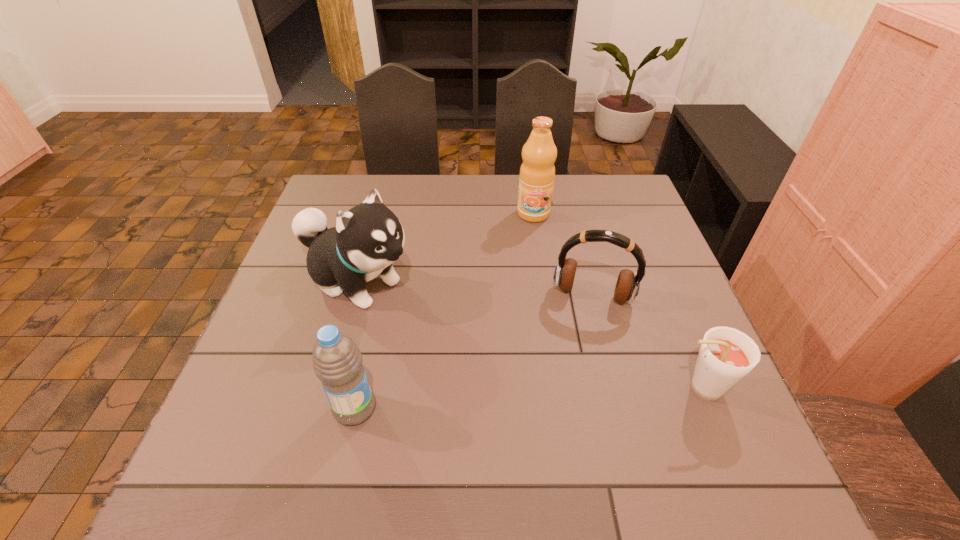
This screenshot has width=960, height=540. Find the location of `the third tallest object`. the third tallest object is located at coordinates (337, 361).

At what (x,y) coordinates should I click in order to perform the action: click on the rightmost object. Please return your answer as a coordinate pair (x, y). Image resolution: width=960 pixels, height=540 pixels. Looking at the image, I should click on (727, 355).

What are the coordinates of `headset` in the screenshot? It's located at (627, 286).

At what (x,y) coordinates should I click in order to perform the action: click on the farthest object. Please return your answer as a coordinate pair (x, y). The image size is (960, 540). Looking at the image, I should click on point(537,172).

At what (x,y) coordinates should I click in order to perform the action: click on puppy. Please return your answer as a coordinate pair (x, y). The image size is (960, 540). Looking at the image, I should click on (368, 238).

Identify the location of free region located on the left of the water bottle. This screenshot has width=960, height=540. (237, 409).

I want to click on free space located on the drink side of the rightmost object, so click(574, 388).

Identify the location of free space located on the drink side of the rightmost object. This screenshot has height=540, width=960. (525, 388).

You are a GUI agent. You are given a task and a screenshot of the screen. Output one action in this format:
    pyautogui.click(x=<x>, y=<y>)
    Task: Click on the vacant space located on the drink side of the rightmost object
    This screenshot has width=960, height=540.
    Given the screenshot: What is the action you would take?
    pyautogui.click(x=549, y=388)

Locate an element on the screen. vacant space located on the ear cup of the headset is located at coordinates (576, 357).